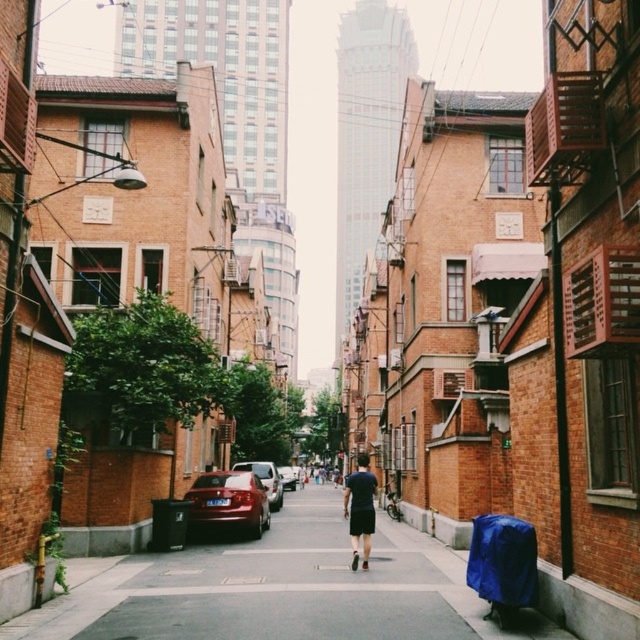
You are driving a delivery van that is 2 meters long. You need to pass through this alleyway. There are two cars parked in the center of the alleyway, a shiny red car at center and a shiny silver sedan at center. Can you determine if there is enough space between the two cars to maneuver your van through?

The shiny red car at center is in front of the shiny silver sedan at center, so there is space between them. However, the alleyway is narrow and the exact distance isn not specified. It might be risky to attempt passing without knowing the exact gap between the two cars.

From the picture: You are a delivery person trying to navigate through the alley. There is a shiny red car at center and a dark blue fabric shorts at center. Which object is blocking your path more?

The shiny red car at center is positioned over dark blue fabric shorts at center, so the shiny red car at center is blocking the path more than the dark blue fabric shorts at center.

You are standing at the entrance of the alley and see the dark blue fabric shorts at center and the shiny silver sedan at center. Which object is nearer to you?

The dark blue fabric shorts at center is closer to the viewer than the shiny silver sedan at center.